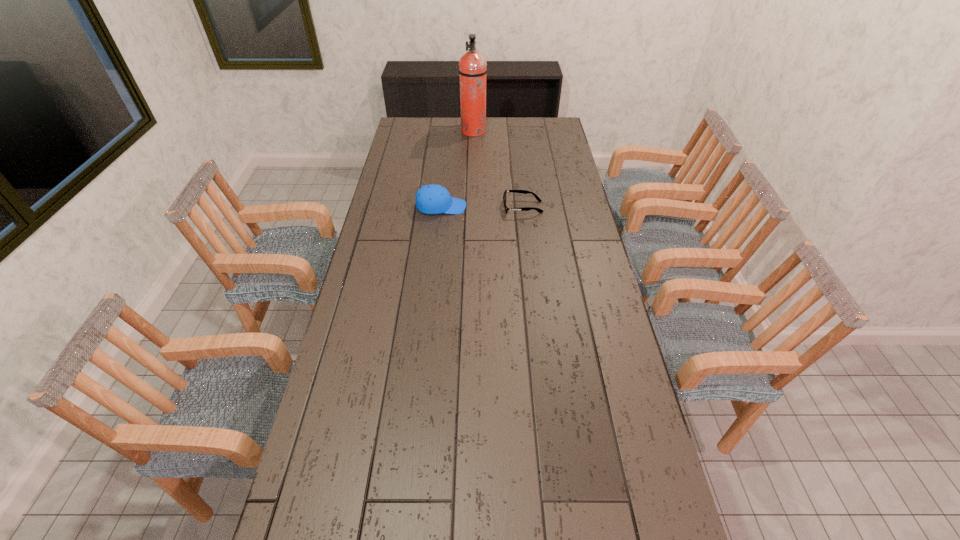
Locate an element on the screen. The image size is (960, 540). the tallest object is located at coordinates (472, 65).

Where is `fire extinguisher`? This screenshot has width=960, height=540. fire extinguisher is located at coordinates coord(472,65).

The height and width of the screenshot is (540, 960). I want to click on the second shortest object, so 430,199.

Find the location of a particular element. The height and width of the screenshot is (540, 960). the rightmost object is located at coordinates (515, 191).

Where is `sunglasses`? The height and width of the screenshot is (540, 960). sunglasses is located at coordinates (515, 191).

This screenshot has width=960, height=540. I want to click on vacant space situated 0.110m at the nozzle of the farthest object, so click(x=507, y=132).

Identify the location of free point located 0.230m on the front-facing side of the cap. The image size is (960, 540). (520, 207).

The height and width of the screenshot is (540, 960). What are the coordinates of `vacant space located 0.180m on the front-facing side of the sunglasses` in the screenshot? It's located at (461, 207).

You are a GUI agent. You are given a task and a screenshot of the screen. Output one action in this format:
    pyautogui.click(x=<x>, y=<y>)
    Task: Click on the vacant space located 0.270m on the front-facing side of the sunglasses
    The width and height of the screenshot is (960, 540).
    Given the screenshot: What is the action you would take?
    pyautogui.click(x=440, y=207)

Locate an element on the screen. free space located on the front-facing side of the sunglasses is located at coordinates (440, 207).